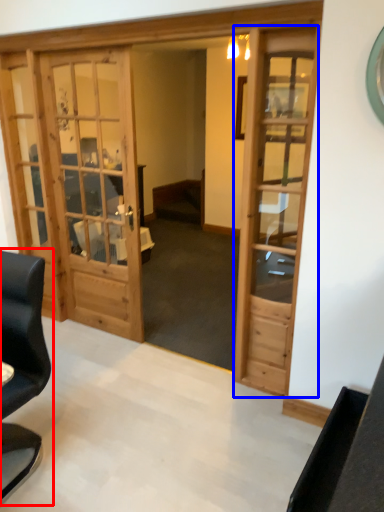
Question: Which object is further to the camera taking this photo, chair (highlighted by a red box) or door (highlighted by a blue box)?

Choices:
 (A) chair
 (B) door

Answer: (B)